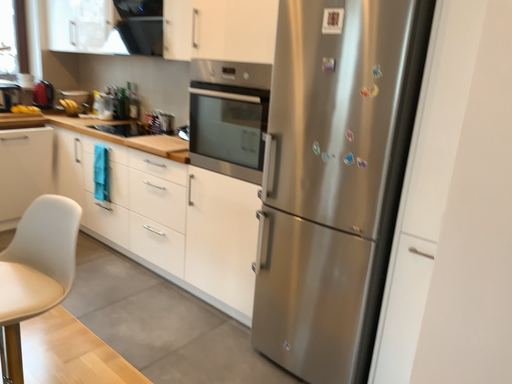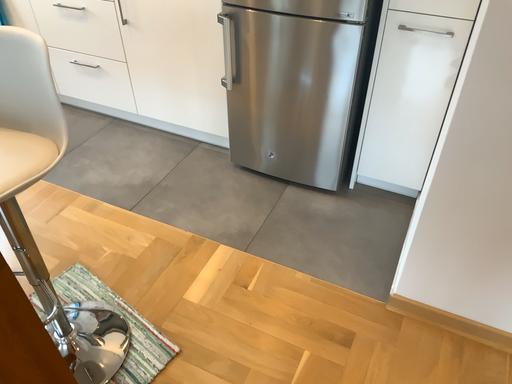
Question: How did the camera likely rotate when shooting the video?

Choices:
 (A) rotated upward
 (B) rotated downward

Answer: (B)